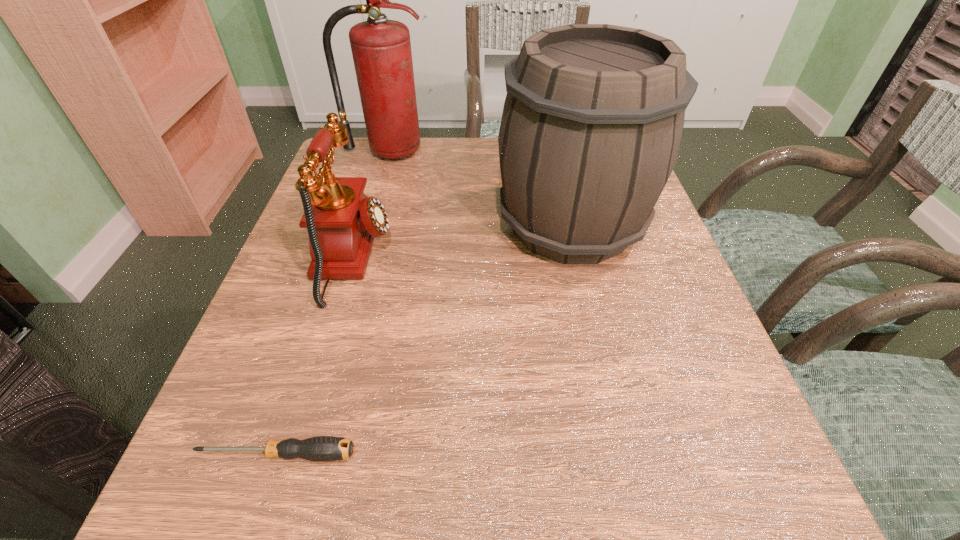
Where is `wine bucket situated at the far edge`? wine bucket situated at the far edge is located at coordinates (592, 122).

Where is `object situated at the near edge`? Image resolution: width=960 pixels, height=540 pixels. object situated at the near edge is located at coordinates (321, 448).

Locate an element on the screen. fire extinguisher at the left edge is located at coordinates (381, 48).

I want to click on telephone present at the left edge, so click(342, 221).

Locate an element on the screen. The height and width of the screenshot is (540, 960). screwdriver that is at the left edge is located at coordinates (321, 448).

Where is `object that is at the right edge`? The width and height of the screenshot is (960, 540). object that is at the right edge is located at coordinates (592, 122).

What are the coordinates of `object that is at the far left corner` in the screenshot? It's located at (381, 48).

You are a GUI agent. You are given a task and a screenshot of the screen. Output one action in this format:
    pyautogui.click(x=<x>, y=<y>)
    Task: Click on the object present at the near left corner
    This screenshot has width=960, height=540.
    Given the screenshot: What is the action you would take?
    pyautogui.click(x=321, y=448)

Identify the location of object located in the far right corner section of the desktop. This screenshot has height=540, width=960. (592, 122).

The image size is (960, 540). What are the coordinates of `vacant space at the far edge of the desktop` in the screenshot? It's located at (411, 164).